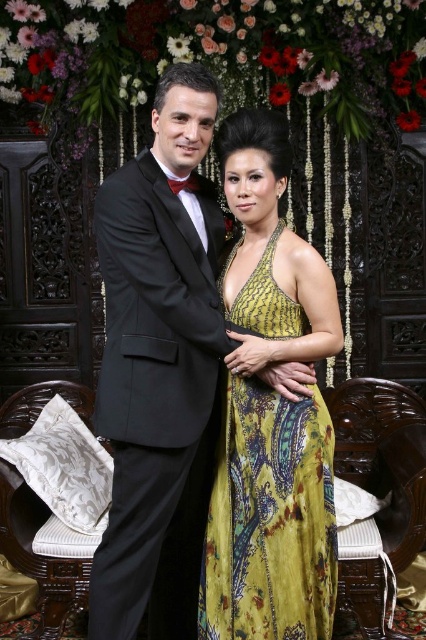
Question: Is shiny black suit at left below yellow printed fabric dress at center?

Choices:
 (A) yes
 (B) no

Answer: (B)

Question: Does shiny black suit at left come behind yellow printed fabric dress at center?

Choices:
 (A) no
 (B) yes

Answer: (A)

Question: Which of the following is the farthest from the observer?

Choices:
 (A) (219, 509)
 (B) (98, 634)

Answer: (A)

Question: From the image, what is the correct spatial relationship of black satin tuxedo at left in relation to yellow printed fabric dress at center?

Choices:
 (A) left
 (B) right

Answer: (A)

Question: Considering the real-world distances, which object is closest to the yellow printed fabric dress at center?

Choices:
 (A) black satin tuxedo at left
 (B) shiny black suit at left

Answer: (B)

Question: Among these points, which one is farthest from the camera?

Choices:
 (A) (282, 403)
 (B) (150, 250)

Answer: (A)